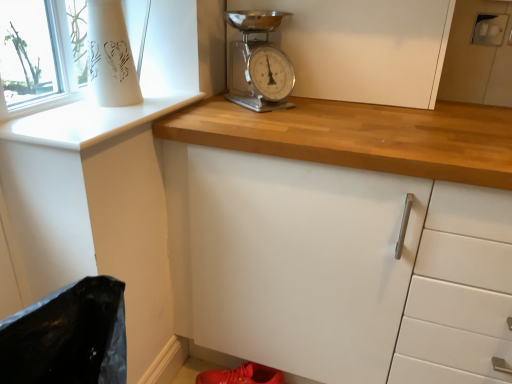
Identify the location of free spot above white glossy window sill at upper left (from a real-world perspective). (106, 114).